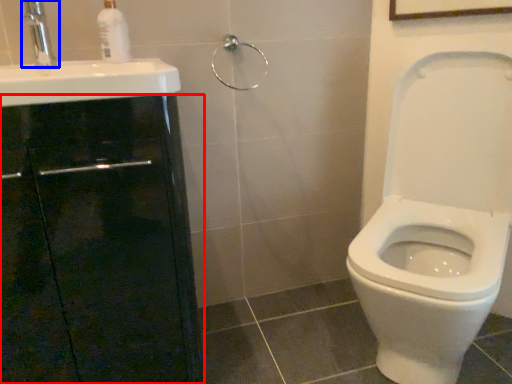
Question: Which point is closer to the camera, screen door (highlighted by a red box) or tap (highlighted by a blue box)?

Choices:
 (A) screen door
 (B) tap

Answer: (A)